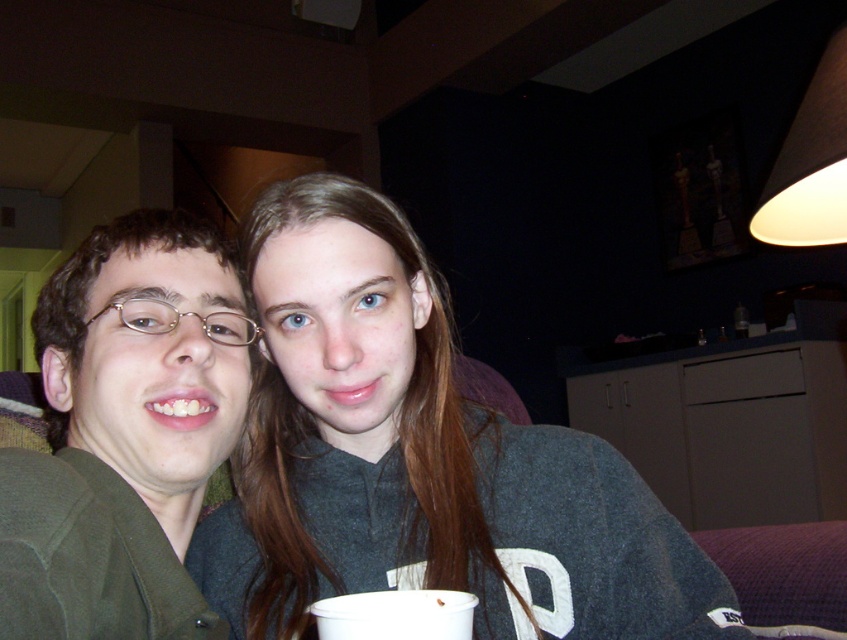
Question: Which object is farther from the camera taking this photo?

Choices:
 (A) green matte jacket at left
 (B) dark gray sweater at center
 (C) white matte lampshade at upper right

Answer: (C)

Question: Is green matte jacket at left further to camera compared to white matte lampshade at upper right?

Choices:
 (A) yes
 (B) no

Answer: (B)

Question: Is dark gray sweater at center thinner than white matte lampshade at upper right?

Choices:
 (A) yes
 (B) no

Answer: (B)

Question: Which object is positioned farthest from the white matte lampshade at upper right?

Choices:
 (A) green matte jacket at left
 (B) dark gray sweater at center

Answer: (A)

Question: Is green matte jacket at left bigger than white matte lampshade at upper right?

Choices:
 (A) yes
 (B) no

Answer: (B)

Question: Among these objects, which one is nearest to the camera?

Choices:
 (A) white matte lampshade at upper right
 (B) green matte jacket at left

Answer: (B)